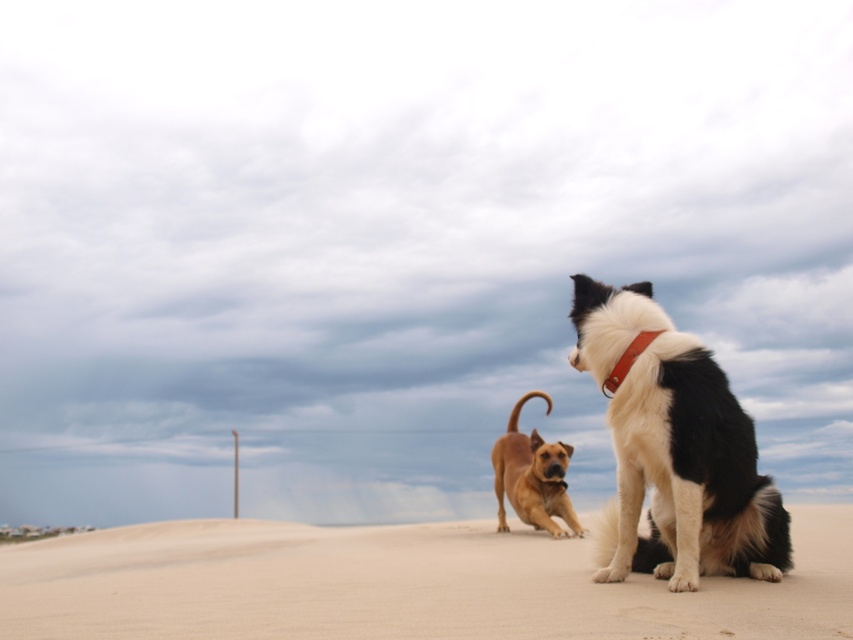
Can you confirm if sandy beige sand at lower center is thinner than golden brown fur at center?

No, sandy beige sand at lower center is not thinner than golden brown fur at center.

Does sandy beige sand at lower center appear on the left side of golden brown fur at center?

Correct, you'll find sandy beige sand at lower center to the left of golden brown fur at center.

At what (x,y) coordinates should I click in order to perform the action: click on sandy beige sand at lower center. Please return your answer as a coordinate pair (x, y). Looking at the image, I should click on (399, 584).

Does sandy beige sand at lower center appear under brown leather neckband at upper right?

Yes, sandy beige sand at lower center is below brown leather neckband at upper right.

Does sandy beige sand at lower center appear over brown leather neckband at upper right?

Incorrect, sandy beige sand at lower center is not positioned above brown leather neckband at upper right.

Is point (711, 611) positioned after point (619, 374)?

No, it is in front of (619, 374).

You are a GUI agent. You are given a task and a screenshot of the screen. Output one action in this format:
    pyautogui.click(x=<x>, y=<y>)
    Task: Click on the sandy beige sand at lower center
    
    Given the screenshot: What is the action you would take?
    pyautogui.click(x=399, y=584)

Measure the distance between golden brown fur at center and brown leather neckband at upper right.

The distance of golden brown fur at center from brown leather neckband at upper right is 17.43 feet.

Does golden brown fur at center lie in front of brown leather neckband at upper right?

No.

Who is more distant from viewer, (515, 433) or (616, 362)?

The point (515, 433) is behind.

The image size is (853, 640). What are the coordinates of `golden brown fur at center` in the screenshot? It's located at click(532, 476).